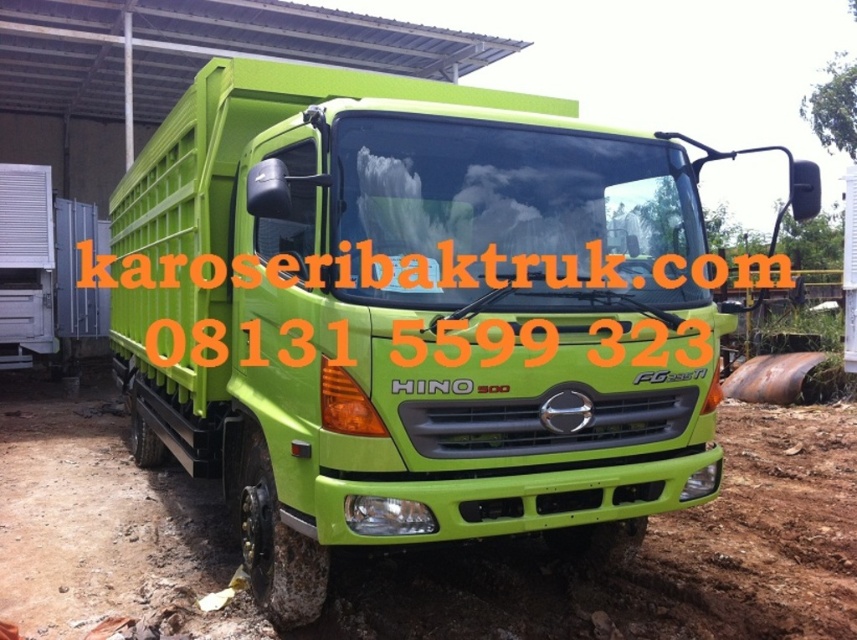
Question: Where is green matte dirt field at center located in relation to green matte truck at left in the image?

Choices:
 (A) left
 (B) right

Answer: (B)

Question: Is green matte dirt field at center bigger than green matte truck at left?

Choices:
 (A) no
 (B) yes

Answer: (B)

Question: Considering the relative positions of green matte dirt field at center and green matte truck at left in the image provided, where is green matte dirt field at center located with respect to green matte truck at left?

Choices:
 (A) right
 (B) left

Answer: (A)

Question: Which of the following is the closest to the observer?

Choices:
 (A) green matte truck at left
 (B) green matte dirt field at center

Answer: (B)

Question: Which point is closer to the camera?

Choices:
 (A) (438, 634)
 (B) (22, 173)

Answer: (A)

Question: Which point appears closest to the camera in this image?

Choices:
 (A) (58, 618)
 (B) (64, 365)

Answer: (A)